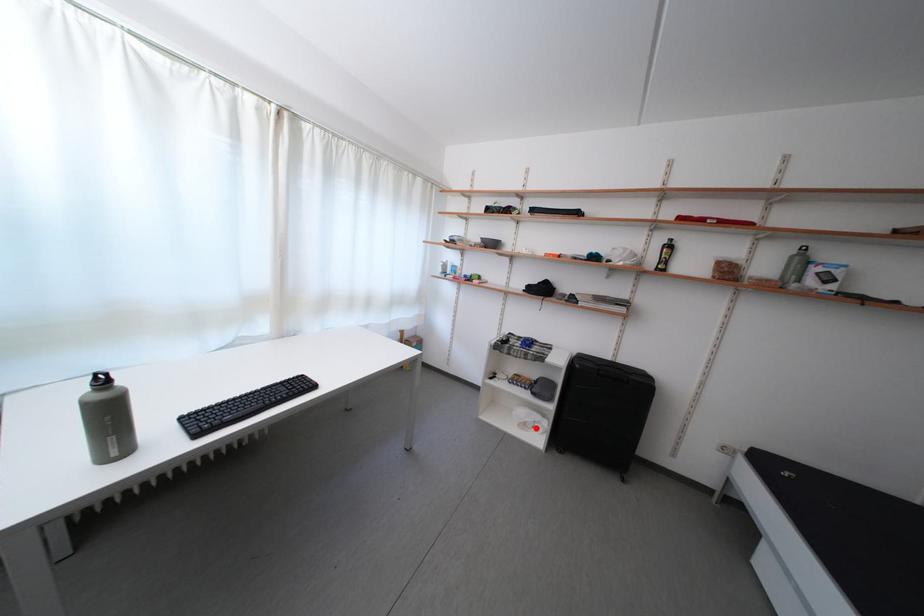
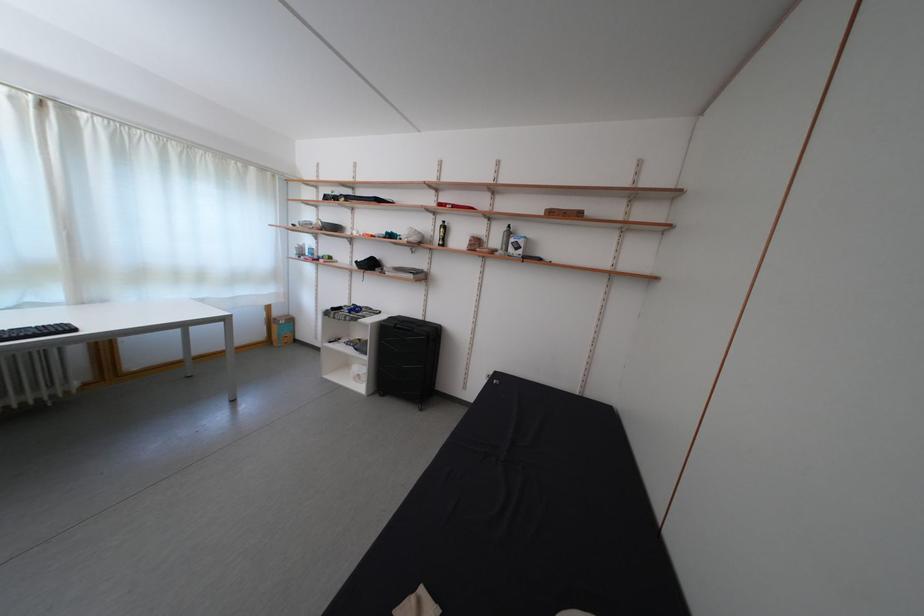
Question: I am providing you with two images of the same scene from different viewpoints. A red point is marked on the first image. Can you still see the location of the red point in image 2?

Choices:
 (A) Yes
 (B) No

Answer: (A)